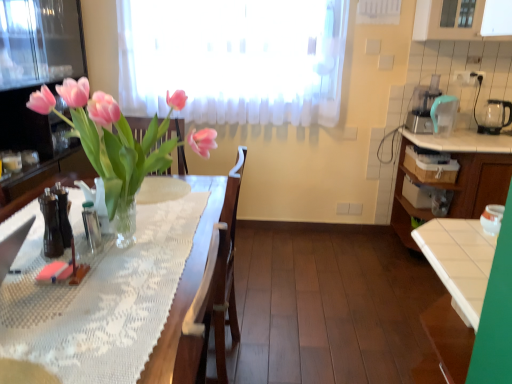
Question: Is the position of teal plastic blender at upper right, marked as the second appliance in a bottom-to-top arrangement, less distant than that of white glossy cabinet at right?

Choices:
 (A) yes
 (B) no

Answer: (B)

Question: Could you tell me if teal plastic blender at upper right, which is the 2th appliance in right-to-left order, is turned towards white glossy cabinet at right?

Choices:
 (A) no
 (B) yes

Answer: (A)

Question: Can you confirm if teal plastic blender at upper right, acting as the second appliance starting from the left, is positioned to the left of white glossy cabinet at right?

Choices:
 (A) yes
 (B) no

Answer: (A)

Question: Considering the relative sizes of teal plastic blender at upper right, marked as the 2th appliance in a back-to-front arrangement, and white glossy cabinet at right in the image provided, is teal plastic blender at upper right, marked as the 2th appliance in a back-to-front arrangement, shorter than white glossy cabinet at right?

Choices:
 (A) no
 (B) yes

Answer: (B)

Question: Is teal plastic blender at upper right, which is the 2th appliance in right-to-left order, looking in the opposite direction of white glossy cabinet at right?

Choices:
 (A) yes
 (B) no

Answer: (B)

Question: Considering the positions of white glossy cabinet at right and transparent glass kettle at right, arranged as the 1th appliance when viewed from the right, in the image, is white glossy cabinet at right wider or thinner than transparent glass kettle at right, arranged as the 1th appliance when viewed from the right,?

Choices:
 (A) wide
 (B) thin

Answer: (A)

Question: Choose the correct answer: Is white glossy cabinet at right inside transparent glass kettle at right, the 3th appliance when ordered from front to back, or outside it?

Choices:
 (A) inside
 (B) outside

Answer: (B)

Question: From their relative heights in the image, would you say white glossy cabinet at right is taller or shorter than transparent glass kettle at right, arranged as the 1th appliance when viewed from the right?

Choices:
 (A) tall
 (B) short

Answer: (A)

Question: Is point (478, 137) positioned closer to the camera than point (476, 119)?

Choices:
 (A) closer
 (B) farther

Answer: (A)

Question: Considering the positions of point (500, 206) and point (399, 173), is point (500, 206) closer or farther from the camera than point (399, 173)?

Choices:
 (A) farther
 (B) closer

Answer: (B)

Question: Would you say white glossy jar at right, the first appliance positioned from the left, is to the left or to the right of white glossy cabinet at right in the picture?

Choices:
 (A) left
 (B) right

Answer: (A)

Question: Is white glossy jar at right, marked as the first appliance in a front-to-back arrangement, in front of or behind white glossy cabinet at right in the image?

Choices:
 (A) behind
 (B) front

Answer: (B)

Question: From a real-world perspective, is white glossy jar at right, which is the first appliance from bottom to top, physically located above or below white glossy cabinet at right?

Choices:
 (A) above
 (B) below

Answer: (A)

Question: From a real-world perspective, relative to white glossy jar at right, marked as the first appliance in a front-to-back arrangement, is transparent glass kettle at right, the 3th appliance in the bottom-to-top sequence, vertically above or below?

Choices:
 (A) above
 (B) below

Answer: (A)

Question: From the image's perspective, is transparent glass kettle at right, the 1th appliance positioned from the top, located above or below white glossy jar at right, the first appliance positioned from the left?

Choices:
 (A) above
 (B) below

Answer: (A)